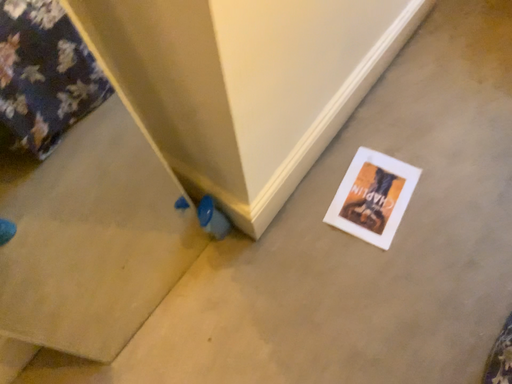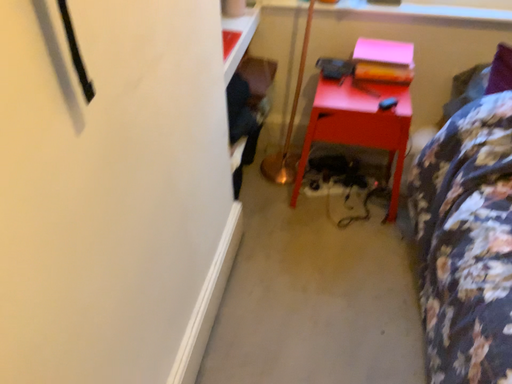
Question: How did the camera likely rotate when shooting the video?

Choices:
 (A) rotated downward
 (B) rotated upward

Answer: (B)